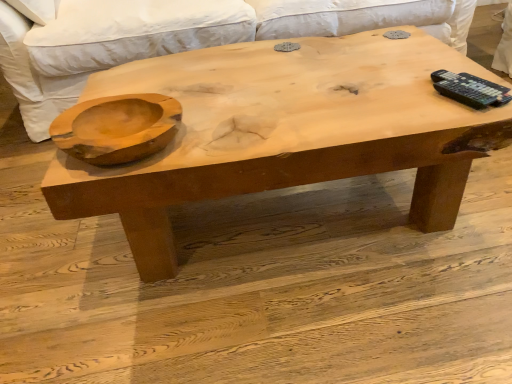
The width and height of the screenshot is (512, 384). In order to click on white fabric couch at upper center in this screenshot , I will do `click(31, 74)`.

Identify the location of white fabric couch at upper center. (31, 74).

Considering the sizes of white fabric couch at upper center and natural wood coffee table at center in the image, is white fabric couch at upper center wider or thinner than natural wood coffee table at center?

Clearly, white fabric couch at upper center has more width compared to natural wood coffee table at center.

There is a natural wood coffee table at center. Identify the location of couch above it (from a real-world perspective). The image size is (512, 384). (31, 74).

Who is smaller, white fabric couch at upper center or natural wood coffee table at center?

natural wood coffee table at center is smaller.

In the scene shown: From a real-world perspective, is white fabric couch at upper center above or below natural wood bowl at left?

Clearly, from a real-world perspective, white fabric couch at upper center is below natural wood bowl at left.

Is white fabric couch at upper center wider than natural wood bowl at left?

Yes.

Based on the photo, who is smaller, white fabric couch at upper center or natural wood bowl at left?

natural wood bowl at left.

From a real-world perspective, is natural wood bowl at left positioned under natural wood coffee table at center based on gravity?

Incorrect, from a real-world perspective, natural wood bowl at left is higher than natural wood coffee table at center.

Does point (95, 139) appear closer or farther from the camera than point (350, 61)?

Point (95, 139).

Is natural wood bowl at left oriented towards natural wood coffee table at center?

No, natural wood bowl at left does not turn towards natural wood coffee table at center.

Which object is further away from the camera, natural wood bowl at left or natural wood coffee table at center?

Positioned behind is natural wood coffee table at center.

Does natural wood coffee table at center contain white fabric couch at upper center?

Definitely not — white fabric couch at upper center is not inside natural wood coffee table at center.

Which is in front, point (193, 72) or point (54, 85)?

Point (193, 72)

Considering the positions of objects natural wood coffee table at center and white fabric couch at upper center in the image provided, who is more to the right, natural wood coffee table at center or white fabric couch at upper center?

Positioned to the right is natural wood coffee table at center.

Who is more distant, natural wood coffee table at center or white fabric couch at upper center?

Positioned behind is white fabric couch at upper center.

Relative to white fabric couch at upper center, is natural wood bowl at left in front or behind?

In the image, natural wood bowl at left appears in front of white fabric couch at upper center.

In the scene shown: From a real-world perspective, between natural wood bowl at left and white fabric couch at upper center, who is vertically higher?

natural wood bowl at left is physically above.

What's the angular difference between natural wood bowl at left and white fabric couch at upper center's facing directions?

The angle between the facing direction of natural wood bowl at left and the facing direction of white fabric couch at upper center is 1.21 degrees.

Does point (136, 101) come in front of point (20, 43)?

Yes, point (136, 101) is in front of point (20, 43).

Are natural wood coffee table at center and natural wood bowl at left located far from each other?

No, natural wood coffee table at center is not far away from natural wood bowl at left.

From a real-world perspective, is natural wood coffee table at center under natural wood bowl at left?

Yes.

The width and height of the screenshot is (512, 384). I want to click on bowl on the left of natural wood coffee table at center, so click(117, 128).

From the image's perspective, which one is positioned lower, natural wood coffee table at center or natural wood bowl at left?

natural wood coffee table at center is shown below in the image.

Locate an element on the screen. Image resolution: width=512 pixels, height=384 pixels. couch behind the natural wood coffee table at center is located at coordinates (31, 74).

This screenshot has width=512, height=384. I want to click on bowl above the white fabric couch at upper center (from a real-world perspective), so click(x=117, y=128).

From the image, which object appears to be farther from white fabric couch at upper center, natural wood coffee table at center or natural wood bowl at left?

The object further to white fabric couch at upper center is natural wood bowl at left.

Considering their positions, is natural wood coffee table at center positioned closer to natural wood bowl at left than white fabric couch at upper center?

natural wood coffee table at center lies closer to natural wood bowl at left than the other object.

Estimate the real-world distances between objects in this image. Which object is closer to white fabric couch at upper center, natural wood bowl at left or natural wood coffee table at center?

Among the two, natural wood coffee table at center is located nearer to white fabric couch at upper center.

Based on their spatial positions, is natural wood bowl at left or white fabric couch at upper center further from natural wood coffee table at center?

white fabric couch at upper center.

From the image, which object appears to be farther from natural wood coffee table at center, white fabric couch at upper center or natural wood bowl at left?

Among the two, white fabric couch at upper center is located further to natural wood coffee table at center.

When comparing their distances from natural wood bowl at left, does white fabric couch at upper center or natural wood coffee table at center seem further?

Based on the image, white fabric couch at upper center appears to be further to natural wood bowl at left.

In order to click on bowl between white fabric couch at upper center and natural wood coffee table at center in the up-down direction in this screenshot , I will do `click(117, 128)`.